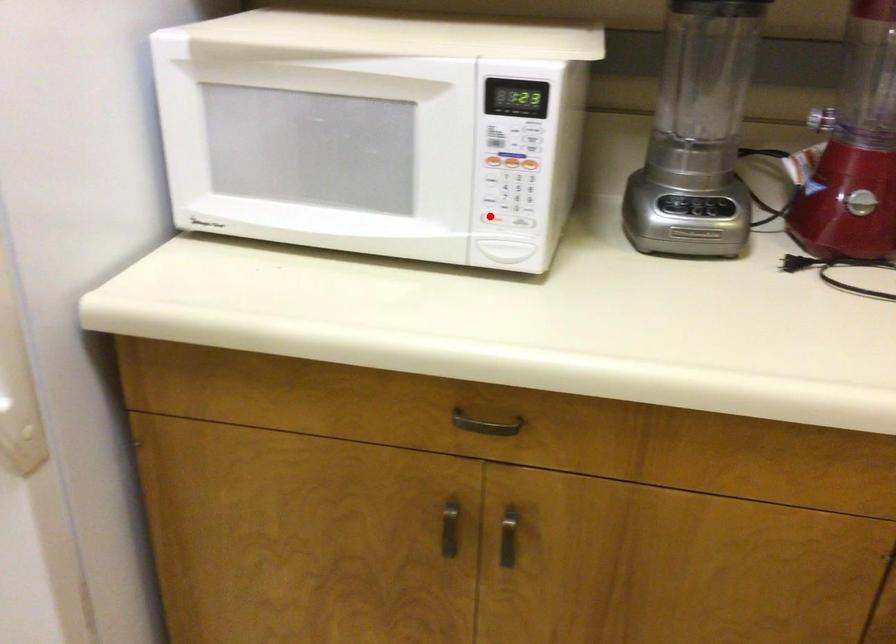
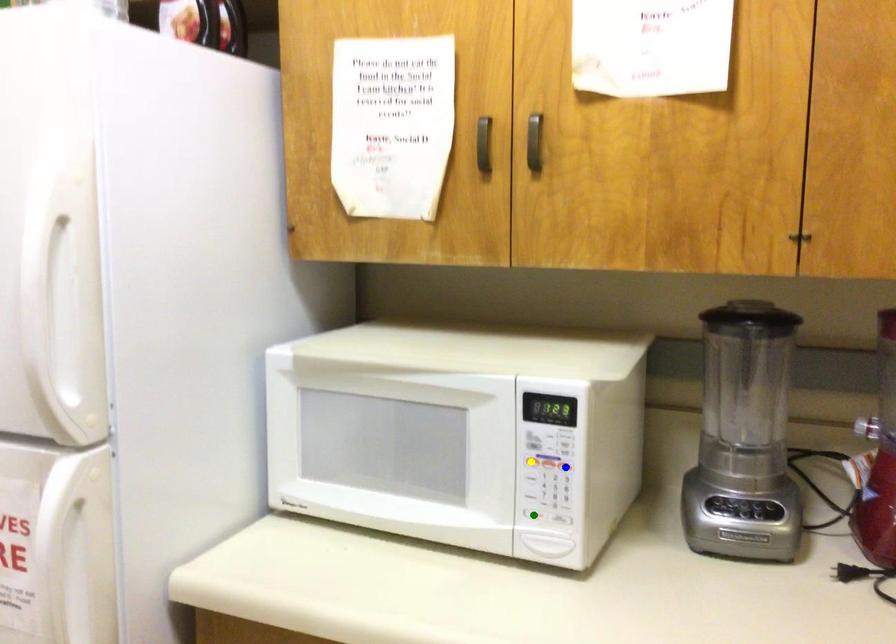
Question: I am providing you with two images of the same scene from different viewpoints. A red point is marked on the first image. You are given multiple points on the second image. Which mark in image 2 goes with the point in image 1?

Choices:
 (A) green point
 (B) blue point
 (C) yellow point

Answer: (A)